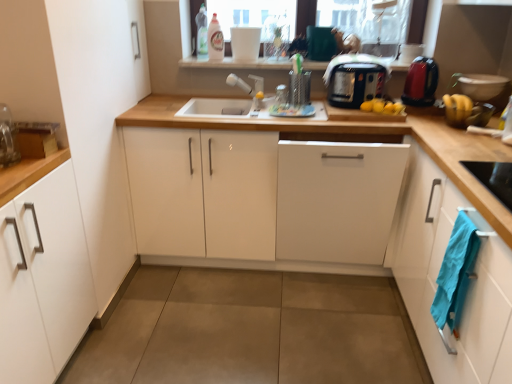
Question: From a real-world perspective, is white matte faucet at center positioned above or below blue cotton towel at lower right?

Choices:
 (A) above
 (B) below

Answer: (A)

Question: Is point [x=233, y=74] positioned closer to the camera than point [x=446, y=309]?

Choices:
 (A) farther
 (B) closer

Answer: (A)

Question: Which of these objects is positioned farthest from the white matte faucet at center?

Choices:
 (A) transparent plastic bottle at upper center, which is the first bottle in left-to-right order
 (B) white matte cabinet at left, marked as the 1th cabinetry in a left-to-right arrangement
 (C) shiny red kettle at right, the 1th appliance when ordered from right to left
 (D) white matte cabinet at center, placed as the second cabinetry when sorted from right to left
 (E) blue cotton towel at lower right

Answer: (E)

Question: Considering the real-world distances, which object is farthest from the white matte cabinet at center, the 3th cabinetry positioned from the left?

Choices:
 (A) white glossy cabinet at center, arranged as the second cabinetry when viewed from the left
 (B) black plastic toaster at upper center, which is the second appliance from right to left
 (C) white matte faucet at center
 (D) translucent plastic bottle at upper center, the 2th bottle from the left
 (E) wooden at center

Answer: (D)